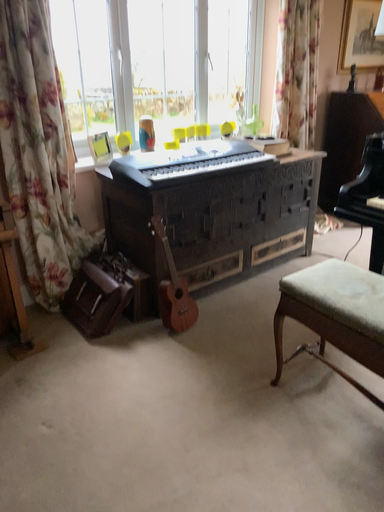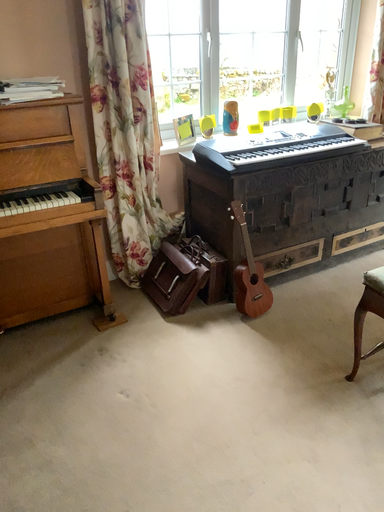
Question: How did the camera likely rotate when shooting the video?

Choices:
 (A) rotated left
 (B) rotated right

Answer: (A)